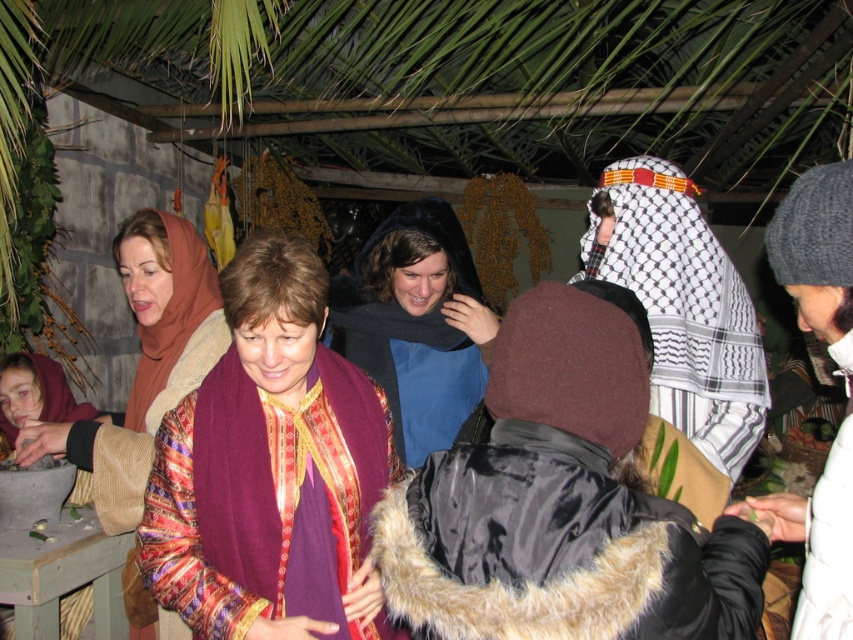
Question: Where is shiny purple scarf at center located in relation to black satin coat at center in the image?

Choices:
 (A) above
 (B) below

Answer: (A)

Question: Which point is closer to the camera?

Choices:
 (A) blue matte scarf at center
 (B) multicolored fabric scarf at center
 (C) shiny purple scarf at center
 (D) black satin coat at center

Answer: (D)

Question: From the image, what is the correct spatial relationship of multicolored fabric scarf at center in relation to knitted gray beanie at right?

Choices:
 (A) right
 (B) left

Answer: (B)

Question: Which object is positioned closest to the blue matte scarf at center?

Choices:
 (A) knitted gray beanie at right
 (B) shiny purple scarf at center
 (C) multicolored fabric scarf at center

Answer: (C)

Question: Is multicolored fabric scarf at center positioned at the back of knitted gray beanie at right?

Choices:
 (A) yes
 (B) no

Answer: (A)

Question: Which object is positioned closest to the knitted gray beanie at right?

Choices:
 (A) white checkered cloth at center
 (B) black satin coat at center
 (C) shiny purple scarf at center

Answer: (B)